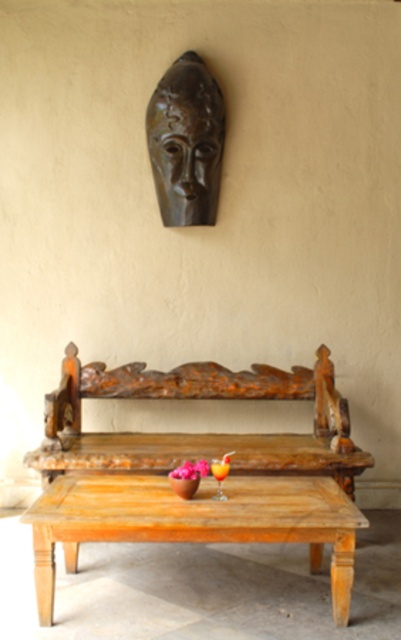
Question: Which point appears farthest from the camera in this image?

Choices:
 (A) (245, 490)
 (B) (313, 451)
 (C) (190, 480)
 (D) (198, 61)

Answer: (D)

Question: Does wooden carved bench at center appear over wooden table at center?

Choices:
 (A) yes
 (B) no

Answer: (A)

Question: Does wooden table at center appear on the right side of matte pink flower at center?

Choices:
 (A) no
 (B) yes

Answer: (A)

Question: From the image, what is the correct spatial relationship of wooden table at center in relation to brown polished wood mask at upper center?

Choices:
 (A) right
 (B) left

Answer: (A)

Question: Estimate the real-world distances between objects in this image. Which object is closer to the wooden table at center?

Choices:
 (A) wooden carved bench at center
 (B) brown polished wood mask at upper center
 (C) matte pink flower at center

Answer: (C)

Question: Which object is positioned closest to the wooden table at center?

Choices:
 (A) wooden carved bench at center
 (B) brown polished wood mask at upper center
 (C) matte pink flower at center

Answer: (C)